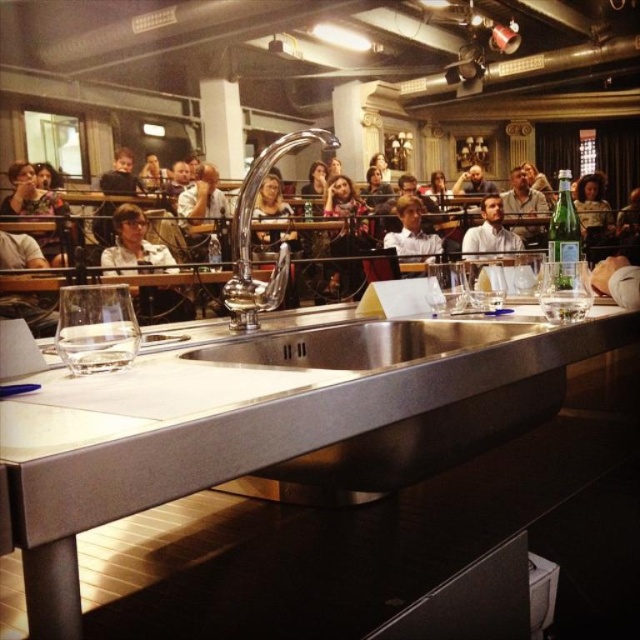
You are a server at a banquet and need to place a 12 inch long bottle of champagne between the polished chrome faucet at center and the clear glass wine glass at right. Can the bottle fit between them?

The distance between the polished chrome faucet at center and the clear glass wine glass at right is 20.64 inches. Since the bottle is 12 inches long, there is enough space to place it between them.

You are preparing to wash your hands in the stainless steel sink at center. You notice the transparent glass at center is nearby. Where is the glass located relative to the sink?

The transparent glass at center is above the stainless steel sink at center.